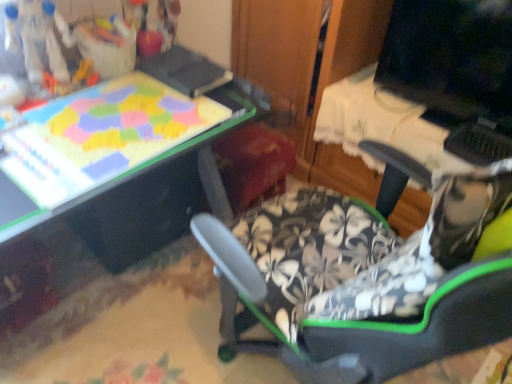
Question: Is matte black monitor at upper right positioned with its back to black plastic drawer at lower left?

Choices:
 (A) yes
 (B) no

Answer: (B)

Question: Could you tell me if matte black monitor at upper right is facing black plastic drawer at lower left?

Choices:
 (A) yes
 (B) no

Answer: (B)

Question: From the image's perspective, is matte black monitor at upper right over black plastic drawer at lower left?

Choices:
 (A) yes
 (B) no

Answer: (A)

Question: Is matte black monitor at upper right beside black plastic drawer at lower left?

Choices:
 (A) no
 (B) yes

Answer: (A)

Question: Is matte black monitor at upper right completely or partially outside of black plastic drawer at lower left?

Choices:
 (A) yes
 (B) no

Answer: (A)

Question: From a real-world perspective, is matte plastic puzzle board at upper left above or below matte black monitor at upper right?

Choices:
 (A) above
 (B) below

Answer: (B)

Question: Is point (140, 82) positioned closer to the camera than point (459, 96)?

Choices:
 (A) closer
 (B) farther

Answer: (A)

Question: Is matte plastic puzzle board at upper left taller or shorter than matte black monitor at upper right?

Choices:
 (A) tall
 (B) short

Answer: (B)

Question: Based on their sizes in the image, would you say matte plastic puzzle board at upper left is bigger or smaller than matte black monitor at upper right?

Choices:
 (A) small
 (B) big

Answer: (A)

Question: Considering the positions of matte black monitor at upper right and black plastic drawer at lower left in the image, is matte black monitor at upper right wider or thinner than black plastic drawer at lower left?

Choices:
 (A) thin
 (B) wide

Answer: (A)

Question: Would you say matte black monitor at upper right is to the left or to the right of black plastic drawer at lower left in the picture?

Choices:
 (A) left
 (B) right

Answer: (B)

Question: Is matte black monitor at upper right bigger or smaller than black plastic drawer at lower left?

Choices:
 (A) small
 (B) big

Answer: (A)

Question: Is point (500, 84) closer or farther from the camera than point (112, 215)?

Choices:
 (A) closer
 (B) farther

Answer: (B)

Question: Is point (143, 208) closer or farther from the camera than point (153, 243)?

Choices:
 (A) closer
 (B) farther

Answer: (A)

Question: Considering the relative positions of matte plastic puzzle board at upper left and black plastic drawer at lower left in the image provided, is matte plastic puzzle board at upper left to the left or to the right of black plastic drawer at lower left?

Choices:
 (A) right
 (B) left

Answer: (A)